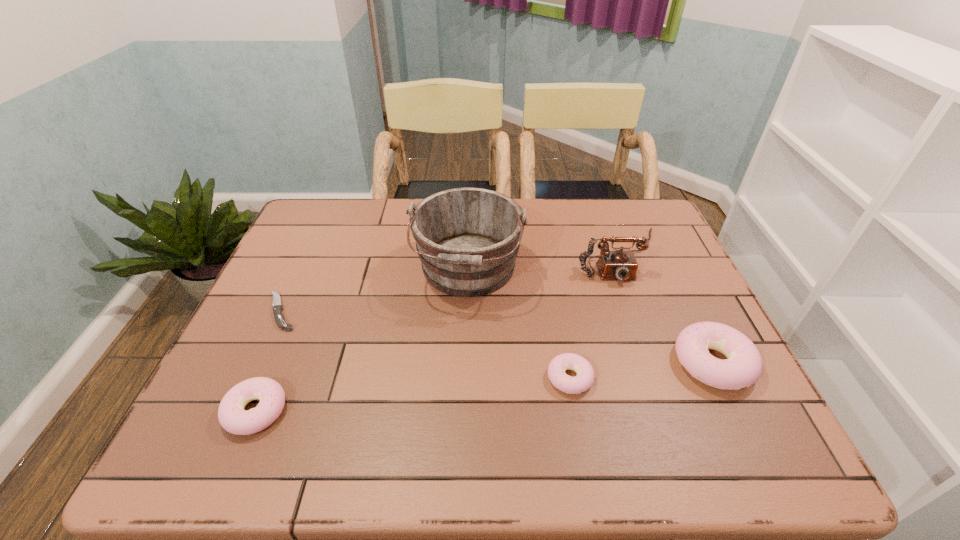
You are a GUI agent. You are given a task and a screenshot of the screen. Output one action in this format:
    pyautogui.click(x=<x>, y=<y>)
    Task: Click on the doughnut that is at the right edge
    This screenshot has height=540, width=960.
    Given the screenshot: What is the action you would take?
    pyautogui.click(x=742, y=368)

Where is `telephone situated at the right edge`? This screenshot has height=540, width=960. telephone situated at the right edge is located at coordinates (622, 265).

Locate an element on the screen. object at the near left corner is located at coordinates (233, 418).

Identify the location of object present at the far right corner. (622, 265).

What are the coordinates of `object that is at the near right corner` in the screenshot? It's located at (742, 368).

Find the location of `free point at the far edge`. free point at the far edge is located at coordinates (580, 205).

In the image, there is a desktop. Identify the location of vacant space at the near edge. The width and height of the screenshot is (960, 540). (430, 402).

I want to click on vacant space at the left edge of the desktop, so click(238, 356).

The image size is (960, 540). Identify the location of vacant space at the far left corner of the desktop. (330, 206).

The height and width of the screenshot is (540, 960). What are the coordinates of `vacant position at the near right corner of the desktop` in the screenshot? It's located at (684, 402).